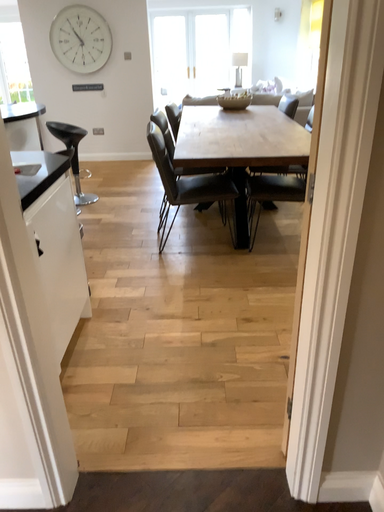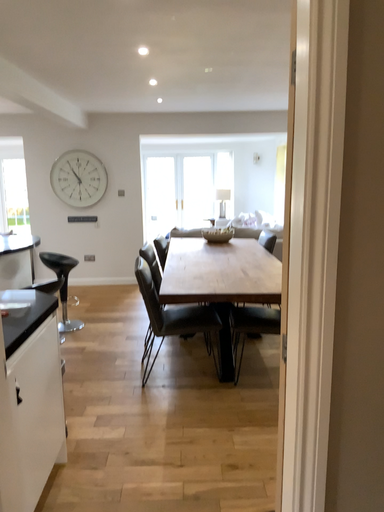
Question: How did the camera likely rotate when shooting the video?

Choices:
 (A) rotated upward
 (B) rotated downward

Answer: (A)